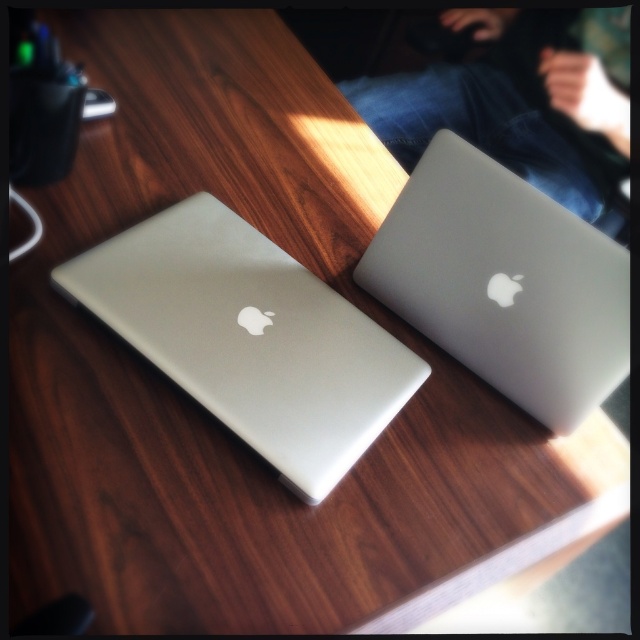
You are organizing a tech showcase and need to stack the sleek silver laptop at center and the satin silver laptop at upper right vertically. Which one should you place at the bottom to ensure stability?

You should place the sleek silver laptop at center at the bottom because it has a greater height compared to the satin silver laptop at upper right, providing a more stable base.

You are standing in front of a wooden table with two Apple laptops. You see a point marked at coordinates (248, 337). Which object is located at that point?

The sleek silver laptop at center is located at point (248, 337).

You are a delivery person who needs to pack two laptops into a box. The box can only accommodate one laptop of the larger size or two of the smaller size. You see the sleek silver laptop at center and the satin silver laptop at upper right on the table. Which laptop should you choose to determine if the box is suitable for both?

You should check the sleek silver laptop at center first because its width is larger than the satin silver laptop at upper right. If the box can fit the sleek silver laptop at center, then it can also accommodate the smaller satin silver laptop at upper right.